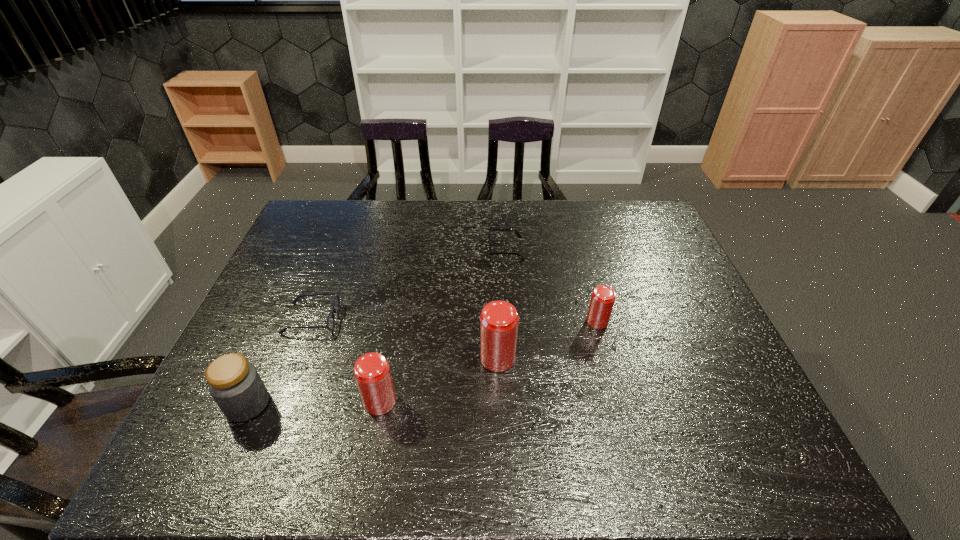
At what (x,y) coordinates should I click in order to perform the action: click on vacant area that lies between the rightmost beer can and the sunglasses. Please return your answer as a coordinate pair (x, y). Looking at the image, I should click on (552, 285).

Locate an element on the screen. Image resolution: width=960 pixels, height=540 pixels. vacant area between the jar and the fourth tallest object is located at coordinates (422, 363).

At what (x,y) coordinates should I click in order to perform the action: click on free spot between the spectacles and the farthest object. Please return your answer as a coordinate pair (x, y). Image resolution: width=960 pixels, height=540 pixels. Looking at the image, I should click on (409, 284).

The width and height of the screenshot is (960, 540). Identify the location of empty space between the sunglasses and the second shortest beer can. (443, 325).

Where is `free space that is in between the second tallest beer can and the spectacles`? The width and height of the screenshot is (960, 540). free space that is in between the second tallest beer can and the spectacles is located at coordinates (346, 360).

The image size is (960, 540). I want to click on empty location between the jar and the rightmost beer can, so click(422, 363).

Identify the location of blank region between the rightmost object and the spectacles. (454, 320).

The width and height of the screenshot is (960, 540). In order to click on free area in between the sunglasses and the jar in this screenshot , I will do `click(376, 326)`.

The height and width of the screenshot is (540, 960). I want to click on free point between the sunglasses and the shortest beer can, so click(x=552, y=285).

Identify the location of object that can be found as the closest to the farthest object. This screenshot has width=960, height=540. (603, 297).